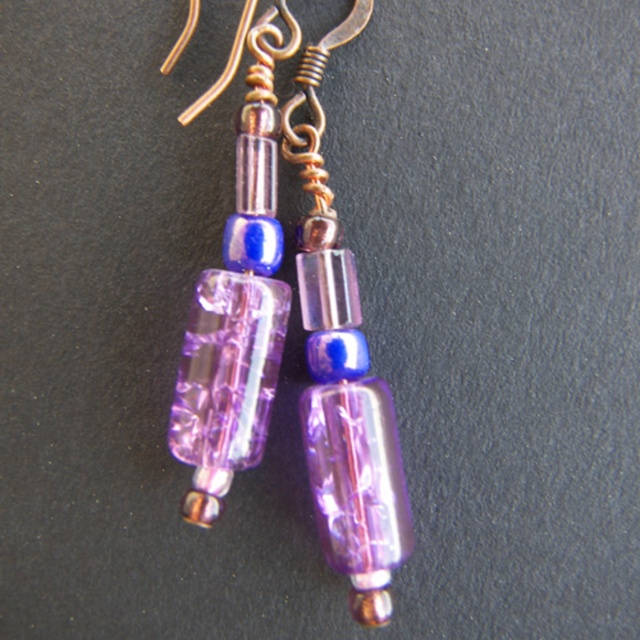
Question: Which of the following is the closest to the observer?

Choices:
 (A) transparent purple glass bead at center
 (B) translucent purple glass bead at center

Answer: (B)

Question: Can you confirm if transparent purple glass bead at center is wider than translucent purple glass bead at center?

Choices:
 (A) no
 (B) yes

Answer: (A)

Question: Observing the image, what is the correct spatial positioning of transparent purple glass bead at center in reference to translucent purple glass bead at center?

Choices:
 (A) left
 (B) right

Answer: (B)

Question: Is transparent purple glass bead at center below translucent purple glass bead at center?

Choices:
 (A) no
 (B) yes

Answer: (B)